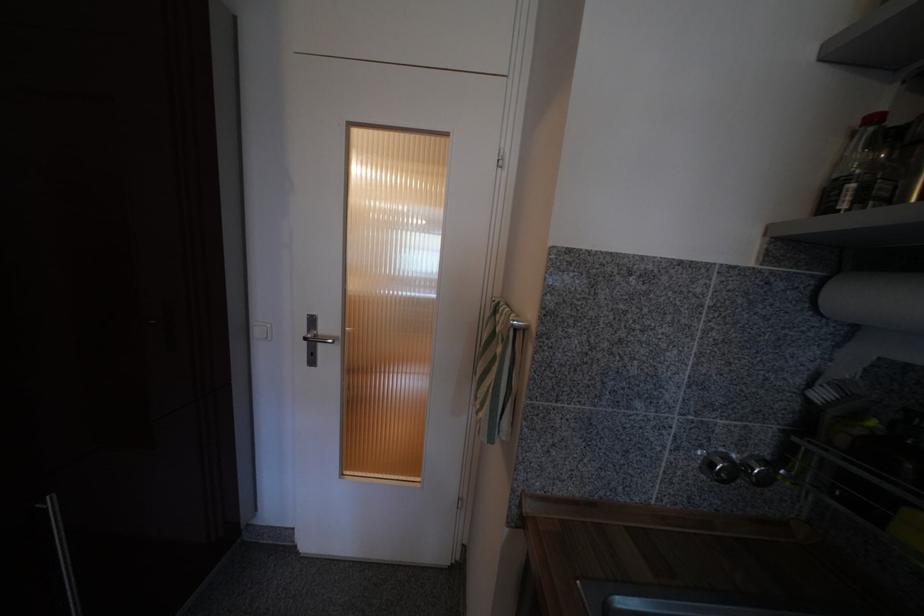
The location [855,168] corresponds to which object?

It corresponds to the clear plastic bottle in the image.